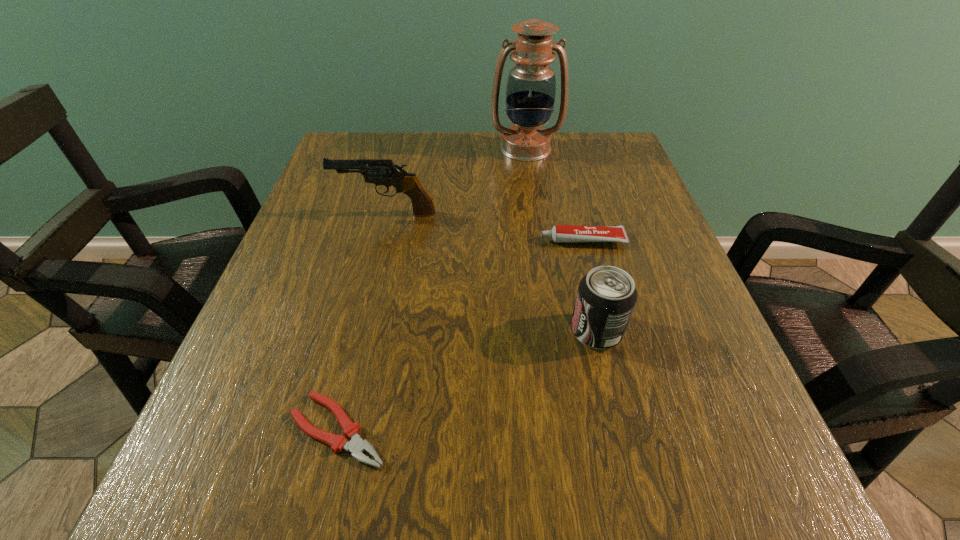
Where is `vacant space located on the right of the third tallest object`? The image size is (960, 540). vacant space located on the right of the third tallest object is located at coordinates (673, 331).

The image size is (960, 540). I want to click on vacant point located 0.260m at the nozzle of the toothpaste, so click(407, 240).

You are a GUI agent. You are given a task and a screenshot of the screen. Output one action in this format:
    pyautogui.click(x=<x>, y=<y>)
    Task: Click on the vacant position located 0.140m at the nozzle of the toothpaste
    Image resolution: width=960 pixels, height=540 pixels.
    Given the screenshot: What is the action you would take?
    pyautogui.click(x=468, y=240)

You are a GUI agent. You are given a task and a screenshot of the screen. Output one action in this format:
    pyautogui.click(x=<x>, y=<y>)
    Task: Click on the vacant space located at the nozzle of the toothpaste
    The width and height of the screenshot is (960, 540).
    Given the screenshot: What is the action you would take?
    point(350,240)

Find the location of a particular element. The height and width of the screenshot is (540, 960). vacant space located on the right of the nearest object is located at coordinates (593, 430).

Locate an element on the screen. The image size is (960, 540). object at the far edge is located at coordinates (531, 85).

The width and height of the screenshot is (960, 540). I want to click on object that is at the near edge, so click(x=356, y=446).

This screenshot has height=540, width=960. Find the location of `gun present at the left edge`. gun present at the left edge is located at coordinates (384, 172).

Locate an element on the screen. The width and height of the screenshot is (960, 540). pliers located at the left edge is located at coordinates (356, 446).

The height and width of the screenshot is (540, 960). What are the coordinates of `oil lamp that is at the right edge` in the screenshot? It's located at point(531,85).